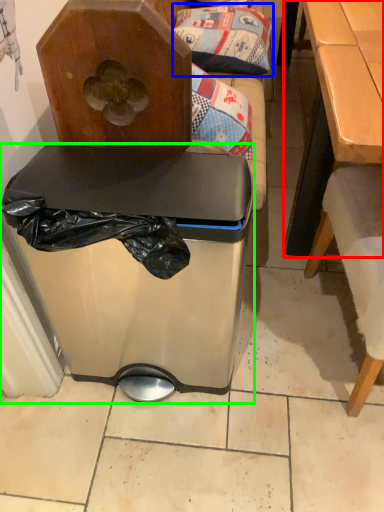
Question: Which object is positioned closest to table (highlighted by a red box)? Select from pillow (highlighted by a blue box) and trash bin/can (highlighted by a green box).

Choices:
 (A) pillow
 (B) trash bin/can

Answer: (A)